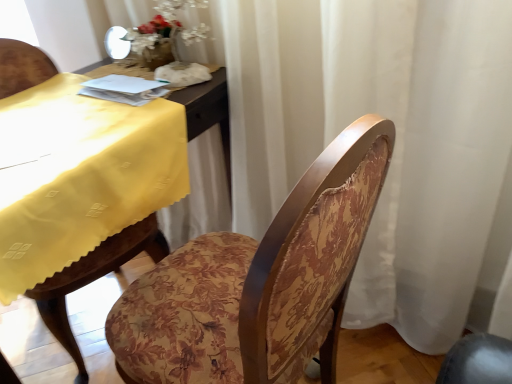
What do you see at coordinates (94, 279) in the screenshot? I see `yellow fabric table at left` at bounding box center [94, 279].

Identify the location of yellow fabric table at left. (94, 279).

At what (x,y) coordinates should I click in order to perform the action: click on floral fabric chair at center. Please return your answer as a coordinate pair (x, y). The width and height of the screenshot is (512, 384). Looking at the image, I should click on (259, 282).

Image resolution: width=512 pixels, height=384 pixels. Describe the element at coordinates (259, 282) in the screenshot. I see `floral fabric chair at center` at that location.

This screenshot has width=512, height=384. What are the coordinates of `yellow fabric table at left` in the screenshot? It's located at (94, 279).

Can you confirm if floral fabric chair at center is positioned to the left of yellow fabric table at left?

In fact, floral fabric chair at center is to the right of yellow fabric table at left.

Is the depth of floral fabric chair at center less than that of yellow fabric table at left?

Yes, floral fabric chair at center is in front of yellow fabric table at left.

Based on the photo, which is closer, (150, 298) or (15, 383)?

Point (150, 298) is positioned farther from the camera compared to point (15, 383).

From the image's perspective, between floral fabric chair at center and yellow fabric table at left, who is located below?

floral fabric chair at center is shown below in the image.

From a real-world perspective, is floral fabric chair at center physically below yellow fabric table at left?

Indeed, from a real-world perspective, floral fabric chair at center is positioned beneath yellow fabric table at left.

Is floral fabric chair at center thinner than yellow fabric table at left?

Yes, floral fabric chair at center is thinner than yellow fabric table at left.

Does floral fabric chair at center have a greater height compared to yellow fabric table at left?

Correct, floral fabric chair at center is much taller as yellow fabric table at left.

Which of these two, floral fabric chair at center or yellow fabric table at left, is smaller?

yellow fabric table at left is smaller.

In the scene shown: Is floral fabric chair at center situated inside yellow fabric table at left or outside?

floral fabric chair at center is outside yellow fabric table at left.

Would you say floral fabric chair at center is a long distance from yellow fabric table at left?

No, floral fabric chair at center is not far away from yellow fabric table at left.

Is floral fabric chair at center facing away from yellow fabric table at left?

floral fabric chair at center is not turned away from yellow fabric table at left.

Identify the location of table above the floral fabric chair at center (from the image's perspective). (94, 279).

Considering the positions of objects yellow fabric table at left and floral fabric chair at center in the image provided, who is more to the left, yellow fabric table at left or floral fabric chair at center?

From the viewer's perspective, yellow fabric table at left appears more on the left side.

Looking at this image, which is in front, yellow fabric table at left or floral fabric chair at center?

floral fabric chair at center.

Is point (78, 369) positioned in front of point (307, 256)?

That is False.

From the image's perspective, between yellow fabric table at left and floral fabric chair at center, which one is located above?

yellow fabric table at left, from the image's perspective.

From a real-world perspective, is yellow fabric table at left above or below floral fabric chair at center?

Clearly, from a real-world perspective, yellow fabric table at left is above floral fabric chair at center.

Which object is wider, yellow fabric table at left or floral fabric chair at center?

Wider between the two is yellow fabric table at left.

Can you confirm if yellow fabric table at left is shorter than floral fabric chair at center?

Correct, yellow fabric table at left is not as tall as floral fabric chair at center.

Which of these two, yellow fabric table at left or floral fabric chair at center, is smaller?

yellow fabric table at left is smaller.

From the picture: Is yellow fabric table at left not inside floral fabric chair at center?

Indeed, yellow fabric table at left is completely outside floral fabric chair at center.

Are yellow fabric table at left and floral fabric chair at center located far from each other?

No, there isn't a large distance between yellow fabric table at left and floral fabric chair at center.

Is yellow fabric table at left turned away from floral fabric chair at center?

No, yellow fabric table at left is not facing away from floral fabric chair at center.

The width and height of the screenshot is (512, 384). In order to click on chair below the yellow fabric table at left (from the image's perspective) in this screenshot , I will do `click(259, 282)`.

The height and width of the screenshot is (384, 512). Identify the location of chair below the yellow fabric table at left (from a real-world perspective). (259, 282).

At what (x,y) coordinates should I click in order to perform the action: click on table lying behind the floral fabric chair at center. Please return your answer as a coordinate pair (x, y). The width and height of the screenshot is (512, 384). Looking at the image, I should click on point(94,279).